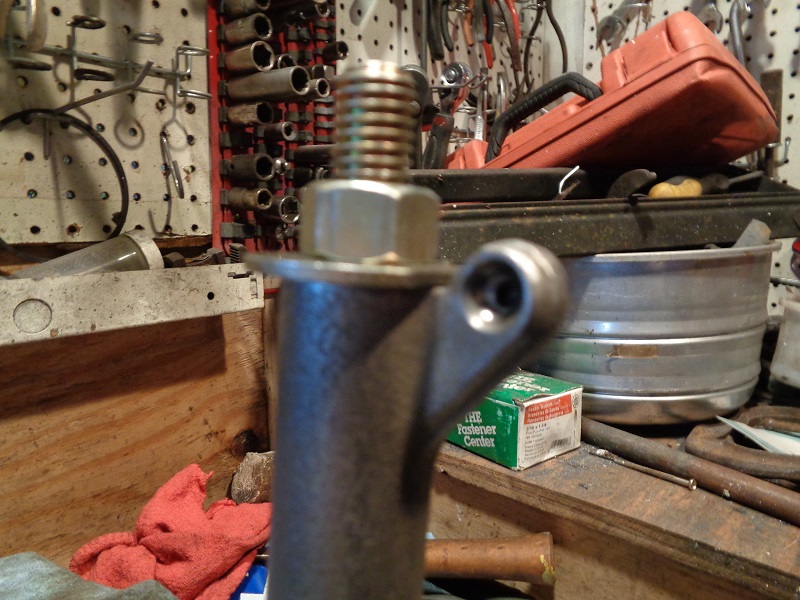
This screenshot has height=600, width=800. What are the coordinates of `basin` in the screenshot? It's located at (713, 302).